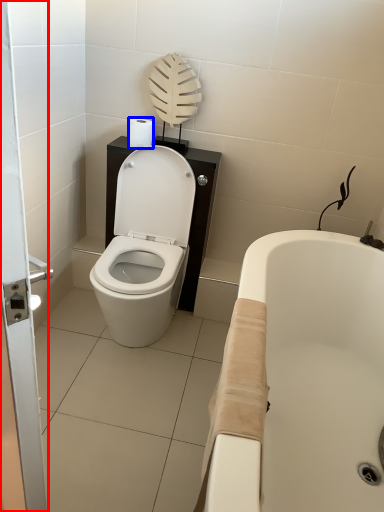
Question: Which point is closer to the camera, screen door (highlighted by a red box) or toilet paper (highlighted by a blue box)?

Choices:
 (A) screen door
 (B) toilet paper

Answer: (A)